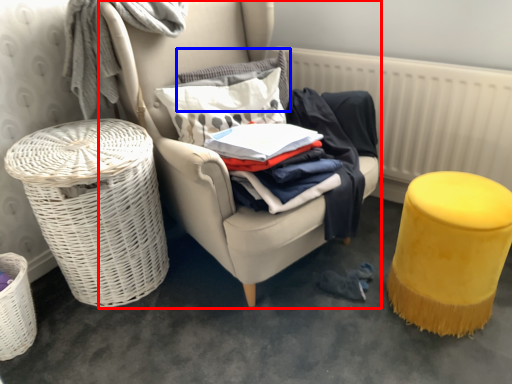
Question: Among these objects, which one is nearest to the camera, chair (highlighted by a red box) or pillow (highlighted by a blue box)?

Choices:
 (A) chair
 (B) pillow

Answer: (A)